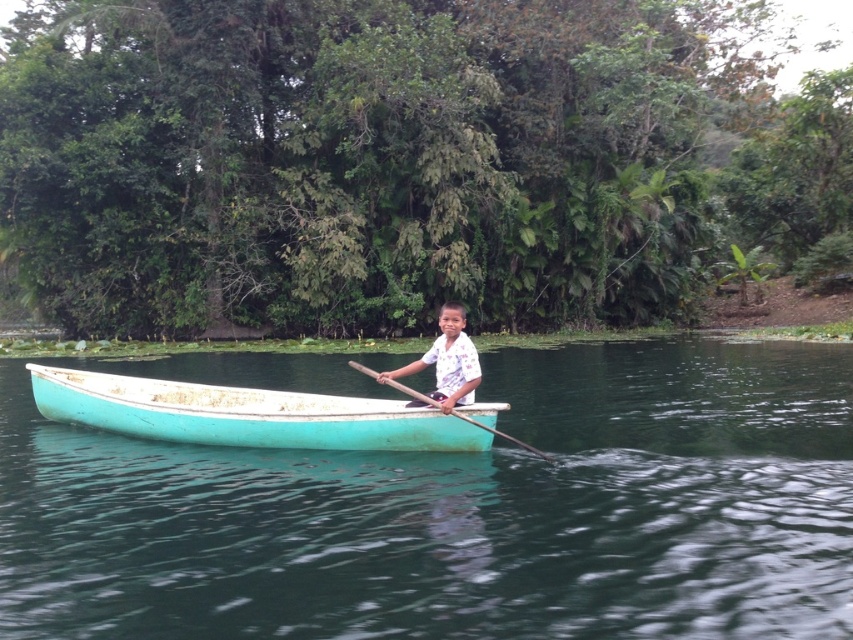
You are a photographer trying to capture the boy in the boat. The camera you are using has a rectangular viewfinder with coordinates from 0 to 1 on both axes. The white printed shirt at center is at position 0.566, 0.525. If you want to frame the boy so that his shirt is exactly in the center of the viewfinder, should you adjust the camera upwards or downwards?

The white printed shirt at center is located at point (447, 362). To center it, since the y coordinate is 0.525 which is slightly below 0.5, you should adjust the camera upwards to bring the shirt into the exact center.

You are standing at the origin point of the coordinate system. You see the teal painted wood boat at center. What are the coordinates of the boat?

The coordinates of the teal painted wood boat at center are at point (245, 413).